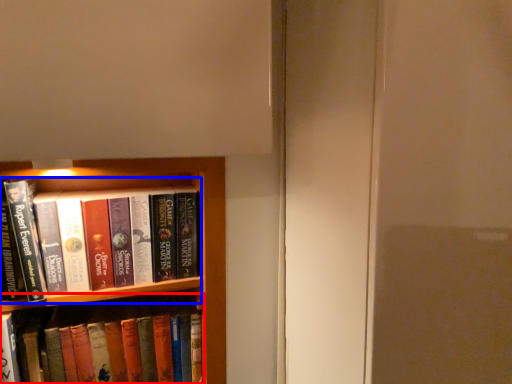
Question: Which object is closer to the camera taking this photo, book (highlighted by a red box) or book (highlighted by a blue box)?

Choices:
 (A) book
 (B) book

Answer: (B)